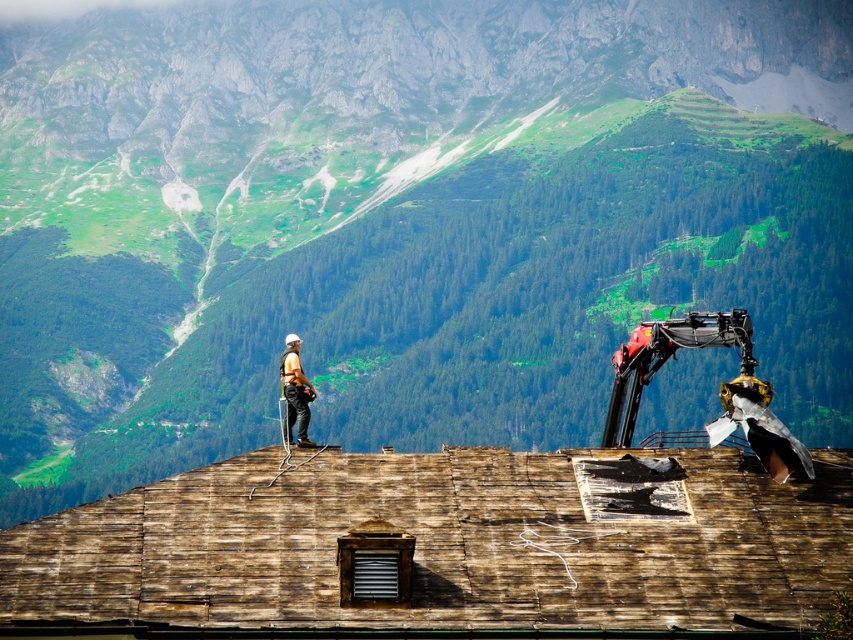
Does point (245, 456) lie behind point (680, 326)?

No, (245, 456) is closer to viewer.

Does weathered wood roof at center have a greater height compared to metallic red robotic arm at upper right?

Incorrect, weathered wood roof at center's height is not larger of metallic red robotic arm at upper right's.

Measure the distance between weathered wood roof at center and camera.

57.95 meters

This screenshot has height=640, width=853. Find the location of `weathered wood roof at center`. weathered wood roof at center is located at coordinates (444, 545).

Is metallic red robotic arm at upper right smaller than white hard hat at center?

Actually, metallic red robotic arm at upper right might be larger than white hard hat at center.

In the scene shown: Is metallic red robotic arm at upper right bigger than white hard hat at center?

Indeed, metallic red robotic arm at upper right has a larger size compared to white hard hat at center.

This screenshot has width=853, height=640. I want to click on metallic red robotic arm at upper right, so click(x=672, y=355).

The image size is (853, 640). Identify the location of weathered wood roof at center. (444, 545).

At what (x,y) coordinates should I click in order to perform the action: click on weathered wood roof at center. Please return your answer as a coordinate pair (x, y). The image size is (853, 640). Looking at the image, I should click on (444, 545).

Image resolution: width=853 pixels, height=640 pixels. I want to click on weathered wood roof at center, so click(444, 545).